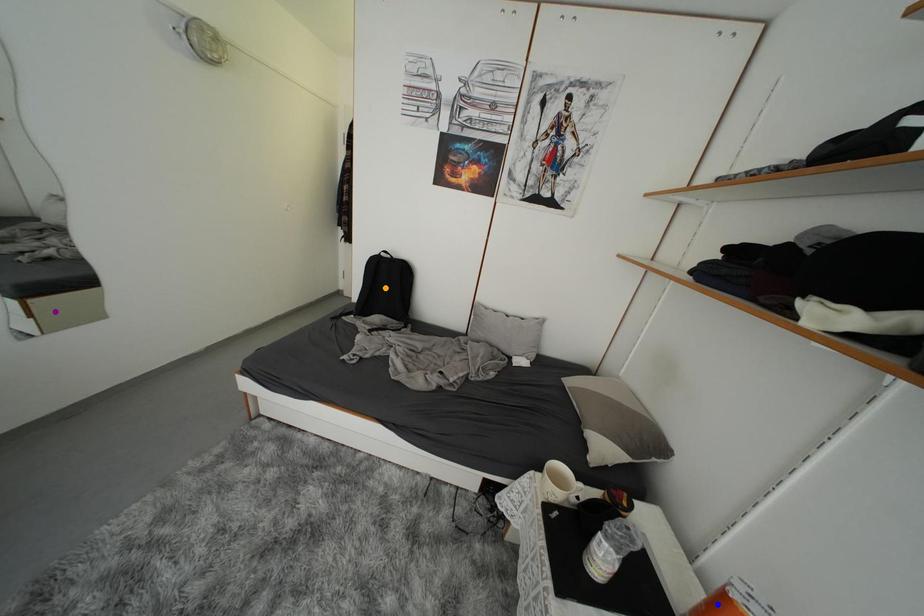
Order these from nearest to farthest:
1. purple point
2. orange point
3. blue point

blue point
purple point
orange point